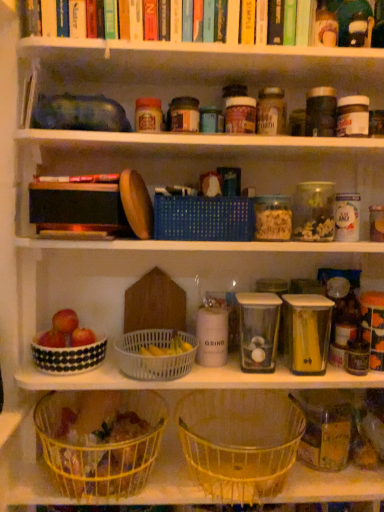
Question: Should I look upward or downward to see clear plastic container at upper right, arranged as the 1th glass jar when viewed from the top?

Choices:
 (A) up
 (B) down

Answer: (A)

Question: Is white plastic basket at center, the 2th basket viewed from the top, aimed at blue woven basket at center, the 1th basket in the top-to-bottom sequence?

Choices:
 (A) yes
 (B) no

Answer: (B)

Question: Could blue woven basket at center, the 4th basket from the bottom, be considered to be inside white plastic basket at center, which appears as the 3th basket when ordered from the bottom?

Choices:
 (A) yes
 (B) no

Answer: (B)

Question: Can you confirm if white plastic basket at center, which appears as the 3th basket when ordered from the bottom, is bigger than blue woven basket at center, the 1th basket in the top-to-bottom sequence?

Choices:
 (A) no
 (B) yes

Answer: (A)

Question: Can you confirm if white plastic basket at center, the 2th basket viewed from the top, is positioned to the right of blue woven basket at center, the 1th basket in the top-to-bottom sequence?

Choices:
 (A) no
 (B) yes

Answer: (A)

Question: From a real-world perspective, is white plastic basket at center, which appears as the 3th basket when ordered from the bottom, positioned over blue woven basket at center, the 4th basket from the bottom, based on gravity?

Choices:
 (A) no
 (B) yes

Answer: (A)

Question: Can you confirm if white plastic basket at center, which appears as the 3th basket when ordered from the bottom, is positioned to the left of blue woven basket at center, the 1th basket in the top-to-bottom sequence?

Choices:
 (A) no
 (B) yes

Answer: (B)

Question: Does clear plastic container at upper right, which ranks as the 2th glass jar in left-to-right order, lie behind red matte apple at lower left, the 2th apple viewed from the right?

Choices:
 (A) yes
 (B) no

Answer: (B)

Question: Is clear plastic container at upper right, arranged as the 1th glass jar when viewed from the top, oriented away from red matte apple at lower left, which is counted as the first apple, starting from the left?

Choices:
 (A) yes
 (B) no

Answer: (B)

Question: From the image's perspective, would you say clear plastic container at upper right, acting as the second glass jar starting from the right, is shown under red matte apple at lower left, which is counted as the first apple, starting from the left?

Choices:
 (A) yes
 (B) no

Answer: (B)

Question: From the image's perspective, is clear plastic container at upper right, acting as the second glass jar starting from the right, on top of red matte apple at lower left, which is counted as the first apple, starting from the left?

Choices:
 (A) no
 (B) yes

Answer: (B)

Question: Would you say clear plastic container at upper right, which appears as the third glass jar when ordered from the bottom, is a long distance from red matte apple at lower left, which is counted as the first apple, starting from the left?

Choices:
 (A) no
 (B) yes

Answer: (A)

Question: Is clear plastic container at upper right, arranged as the 1th glass jar when viewed from the top, bigger than red matte apple at lower left, which is counted as the first apple, starting from the left?

Choices:
 (A) no
 (B) yes

Answer: (B)

Question: Is white plastic basket at center, which appears as the 3th basket when ordered from the bottom, shorter than yellow wire basket at lower center, which ranks as the 4th basket in top-to-bottom order?

Choices:
 (A) no
 (B) yes

Answer: (B)